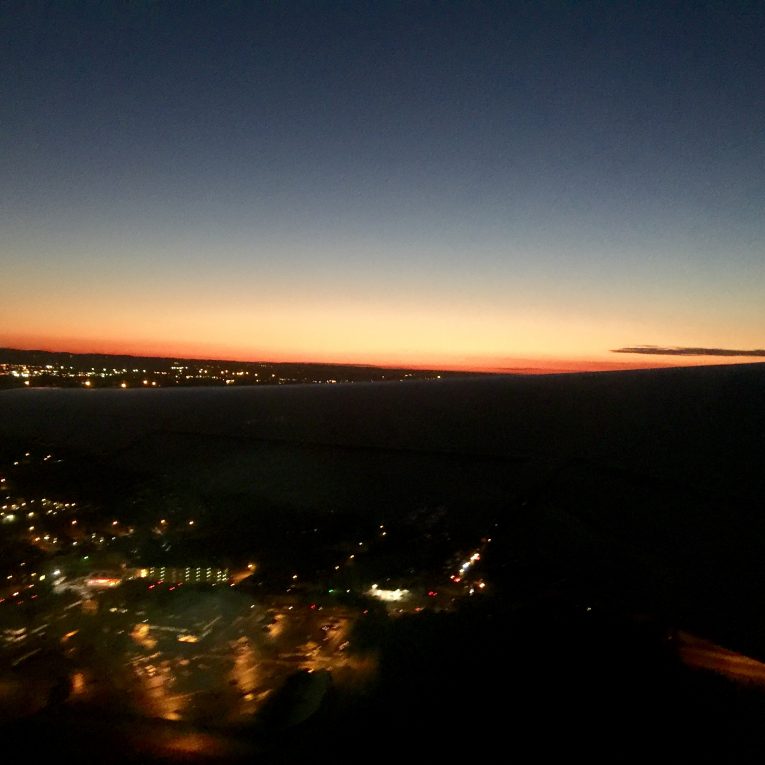
You are a GUI agent. You are given a task and a screenshot of the screen. Output one action in this format:
    pyautogui.click(x=<x>, y=<y>)
    Task: Click on the bright white light
    
    Given the screenshot: What is the action you would take?
    pyautogui.click(x=382, y=594)